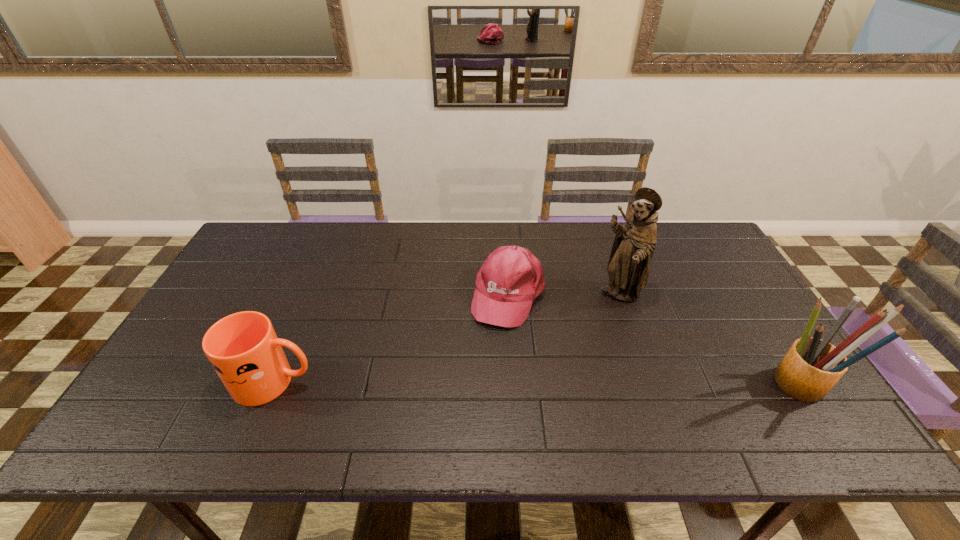
This screenshot has height=540, width=960. In order to click on mug in this screenshot , I will do `click(243, 348)`.

You are a GUI agent. You are given a task and a screenshot of the screen. Output one action in this format:
    pyautogui.click(x=<x>, y=<y>)
    Task: Click on the second shortest object
    Image resolution: width=960 pixels, height=540 pixels.
    Given the screenshot: What is the action you would take?
    pyautogui.click(x=243, y=348)

Where is `the second tallest object`? the second tallest object is located at coordinates (812, 366).

Identify the location of the rightmost object. The width and height of the screenshot is (960, 540). (812, 366).

The height and width of the screenshot is (540, 960). I want to click on the third object from left to right, so click(x=628, y=267).

You are a GUI agent. You are given a task and a screenshot of the screen. Output one action in this format:
    pyautogui.click(x=<x>, y=<y>)
    Task: Click on the tallest object
    
    Given the screenshot: What is the action you would take?
    pyautogui.click(x=628, y=267)

Locate an element on the screen. This screenshot has height=540, width=960. the third object from right to left is located at coordinates [511, 277].

Image resolution: width=960 pixels, height=540 pixels. In order to click on the shortest object in this screenshot , I will do 511,277.

Locate an element on the screen. vacant space located 0.110m on the handle side of the leftmost object is located at coordinates (362, 382).

The height and width of the screenshot is (540, 960). Identify the location of free space located on the left of the pencil box. (676, 384).